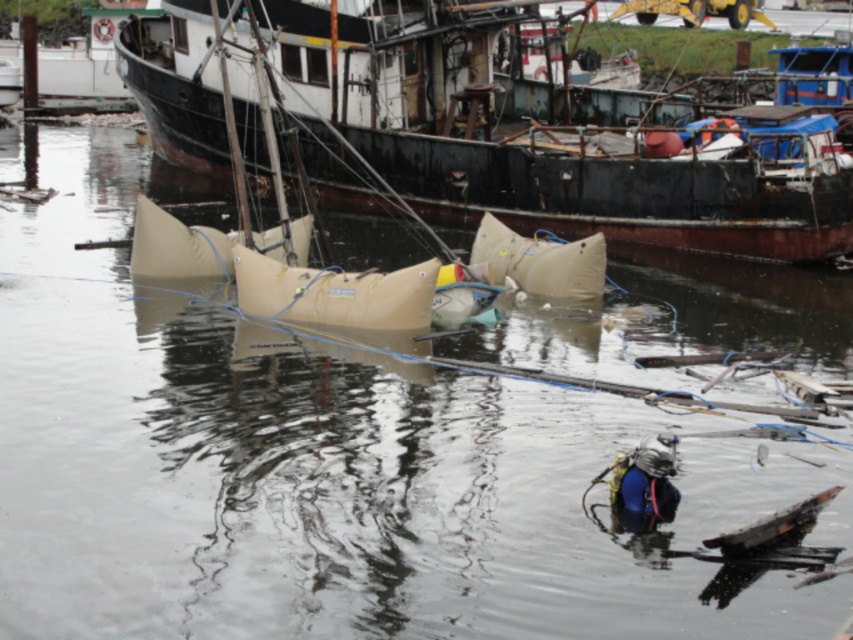
Question: Is beige rubber boat at center above blue matte diving suit at lower center?

Choices:
 (A) yes
 (B) no

Answer: (A)

Question: Which point appears farthest from the camera in this image?

Choices:
 (A) (660, 460)
 (B) (375, 48)

Answer: (B)

Question: Does beige rubber boat at center appear on the right side of blue matte diving suit at lower center?

Choices:
 (A) yes
 (B) no

Answer: (B)

Question: Can you confirm if beige rubber boat at center is positioned below blue matte diving suit at lower center?

Choices:
 (A) no
 (B) yes

Answer: (A)